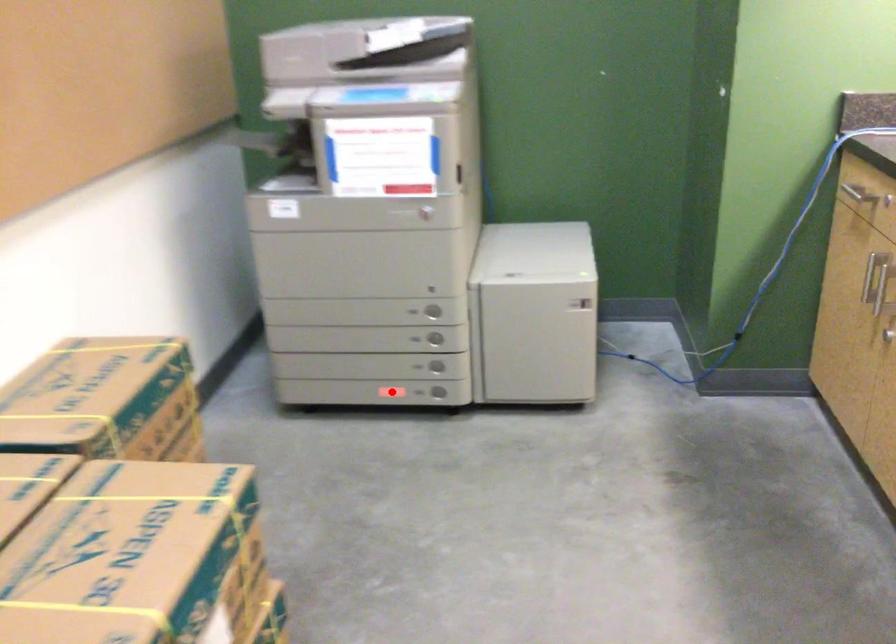
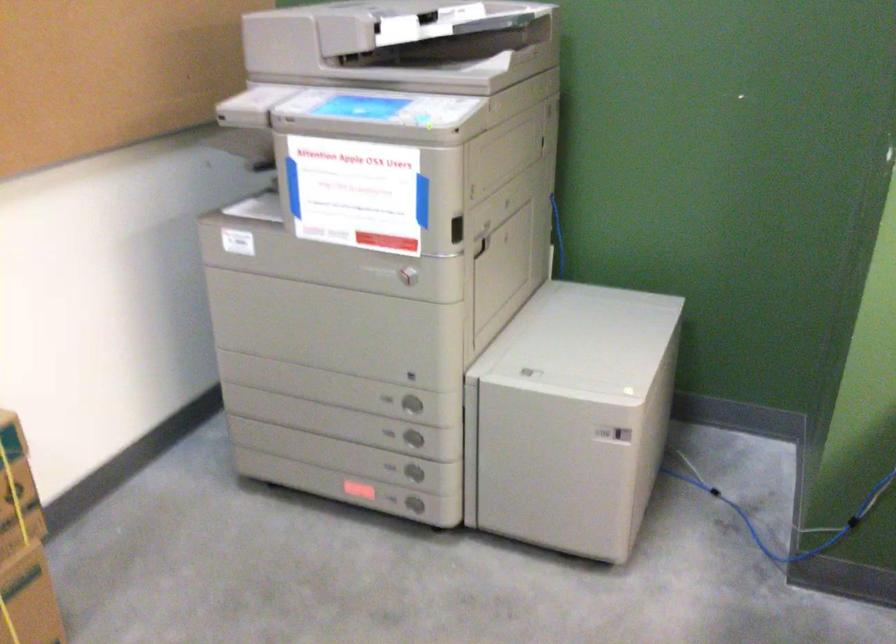
Question: I am providing you with two images of the same scene from different viewpoints. A red point is shown in image1. For the corresponding object point in image2, is it positioned nearer or farther from the camera?

Choices:
 (A) Nearer
 (B) Farther

Answer: (A)